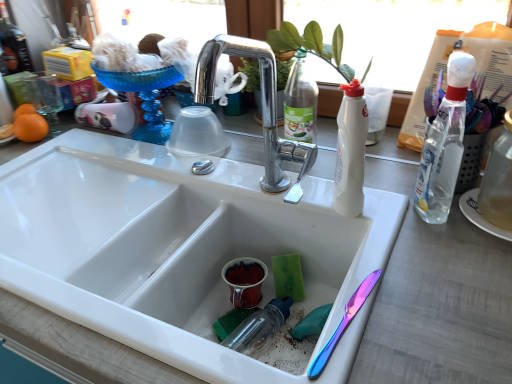
Question: From a real-world perspective, does clear glass bottle at right, which ranks as the third bottle in left-to-right order, sit lower than white matte bottle at center, which appears as the 1th bottle when viewed from the left?

Choices:
 (A) no
 (B) yes

Answer: (B)

Question: Can you confirm if clear glass bottle at right, which ranks as the third bottle in left-to-right order, is shorter than white matte bottle at center, which appears as the 1th bottle when viewed from the left?

Choices:
 (A) yes
 (B) no

Answer: (A)

Question: From a real-world perspective, is clear glass bottle at right, positioned as the first bottle in right-to-left order, over white matte bottle at center, which appears as the 1th bottle when viewed from the left?

Choices:
 (A) yes
 (B) no

Answer: (B)

Question: Is clear glass bottle at right, positioned as the first bottle in right-to-left order, outside white matte bottle at center, which appears as the 1th bottle when viewed from the left?

Choices:
 (A) no
 (B) yes

Answer: (B)

Question: From the image's perspective, is clear glass bottle at right, positioned as the first bottle in right-to-left order, located beneath white matte bottle at center, the 3th bottle positioned from the right?

Choices:
 (A) yes
 (B) no

Answer: (A)

Question: From the image's perspective, is clear plastic bottle at right, the 2th bottle from the left, above or below white glossy sink at center?

Choices:
 (A) below
 (B) above

Answer: (B)

Question: Relative to white glossy sink at center, is clear plastic bottle at right, the 2th bottle from the left, in front or behind?

Choices:
 (A) behind
 (B) front

Answer: (A)

Question: From a real-world perspective, is clear plastic bottle at right, the second bottle when ordered from right to left, physically located above or below white glossy sink at center?

Choices:
 (A) above
 (B) below

Answer: (A)

Question: Is clear plastic bottle at right, the 2th bottle from the left, wider or thinner than white glossy sink at center?

Choices:
 (A) wide
 (B) thin

Answer: (B)

Question: Does point (488, 213) appear closer or farther from the camera than point (380, 221)?

Choices:
 (A) farther
 (B) closer

Answer: (A)

Question: Considering the positions of clear glass bottle at right, positioned as the first bottle in right-to-left order, and white glossy sink at center in the image, is clear glass bottle at right, positioned as the first bottle in right-to-left order, taller or shorter than white glossy sink at center?

Choices:
 (A) tall
 (B) short

Answer: (B)

Question: In terms of width, does clear glass bottle at right, positioned as the first bottle in right-to-left order, look wider or thinner when compared to white glossy sink at center?

Choices:
 (A) wide
 (B) thin

Answer: (B)

Question: Is clear glass bottle at right, positioned as the first bottle in right-to-left order, inside or outside of white glossy sink at center?

Choices:
 (A) inside
 (B) outside

Answer: (B)

Question: Is point (428, 193) closer or farther from the camera than point (20, 129)?

Choices:
 (A) closer
 (B) farther

Answer: (A)

Question: Relative to orange matte at left, is clear plastic bottle at right, the second bottle when ordered from right to left, in front or behind?

Choices:
 (A) front
 (B) behind

Answer: (A)